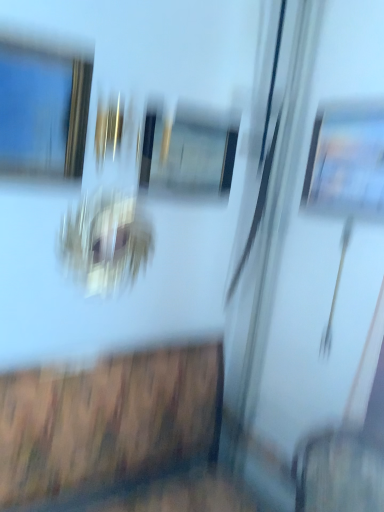
Question: Would you say metallic gold frame at upper left is to the left or to the right of transparent glass screen door at center in the picture?

Choices:
 (A) right
 (B) left

Answer: (B)

Question: Is metallic gold frame at upper left bigger or smaller than transparent glass screen door at center?

Choices:
 (A) big
 (B) small

Answer: (B)

Question: Does point (46, 140) appear closer or farther from the camera than point (276, 298)?

Choices:
 (A) farther
 (B) closer

Answer: (B)

Question: Is transparent glass screen door at center in front of or behind metallic gold frame at upper left in the image?

Choices:
 (A) behind
 (B) front

Answer: (A)

Question: From a real-world perspective, is transparent glass screen door at center positioned above or below metallic gold frame at upper left?

Choices:
 (A) above
 (B) below

Answer: (B)

Question: Which is correct: transparent glass screen door at center is inside metallic gold frame at upper left, or outside of it?

Choices:
 (A) outside
 (B) inside

Answer: (A)

Question: Considering the positions of transparent glass screen door at center and metallic gold frame at upper left in the image, is transparent glass screen door at center taller or shorter than metallic gold frame at upper left?

Choices:
 (A) short
 (B) tall

Answer: (B)